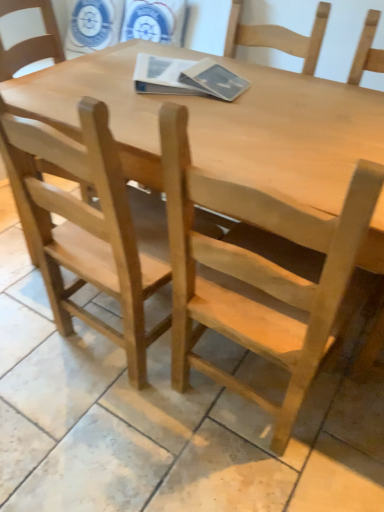
Question: Does natural wood chair at center, the second chair from the left, come in front of natural wood table at center?

Choices:
 (A) yes
 (B) no

Answer: (A)

Question: From the image's perspective, is natural wood chair at center, placed as the first chair when sorted from right to left, beneath natural wood table at center?

Choices:
 (A) no
 (B) yes

Answer: (B)

Question: Is natural wood chair at center, the second chair from the left, placed right next to natural wood table at center?

Choices:
 (A) yes
 (B) no

Answer: (B)

Question: Is natural wood chair at center, the second chair from the left, bigger than natural wood table at center?

Choices:
 (A) yes
 (B) no

Answer: (B)

Question: From a real-world perspective, is natural wood chair at center, the second chair from the left, positioned under natural wood table at center based on gravity?

Choices:
 (A) no
 (B) yes

Answer: (A)

Question: Does natural wood chair at center, the second chair from the left, appear on the left side of natural wood table at center?

Choices:
 (A) no
 (B) yes

Answer: (A)

Question: From a real-world perspective, is natural wood table at center under natural wood chair at center, the second chair from the left?

Choices:
 (A) no
 (B) yes

Answer: (B)

Question: Considering the relative positions of natural wood table at center and natural wood chair at center, the second chair from the left, in the image provided, is natural wood table at center to the right of natural wood chair at center, the second chair from the left, from the viewer's perspective?

Choices:
 (A) no
 (B) yes

Answer: (A)

Question: From the image's perspective, is natural wood table at center under natural wood chair at center, the second chair from the left?

Choices:
 (A) yes
 (B) no

Answer: (B)

Question: Is natural wood table at center to the left of natural wood chair at center, placed as the first chair when sorted from right to left, from the viewer's perspective?

Choices:
 (A) no
 (B) yes

Answer: (B)

Question: Is natural wood table at center facing away from natural wood chair at center, placed as the first chair when sorted from right to left?

Choices:
 (A) yes
 (B) no

Answer: (B)

Question: Is natural wood table at center smaller than natural wood chair at center, the second chair from the left?

Choices:
 (A) yes
 (B) no

Answer: (B)

Question: Is natural wood chair at left, the 1th chair in the left-to-right sequence, looking in the opposite direction of natural wood chair at center, placed as the first chair when sorted from right to left?

Choices:
 (A) yes
 (B) no

Answer: (B)